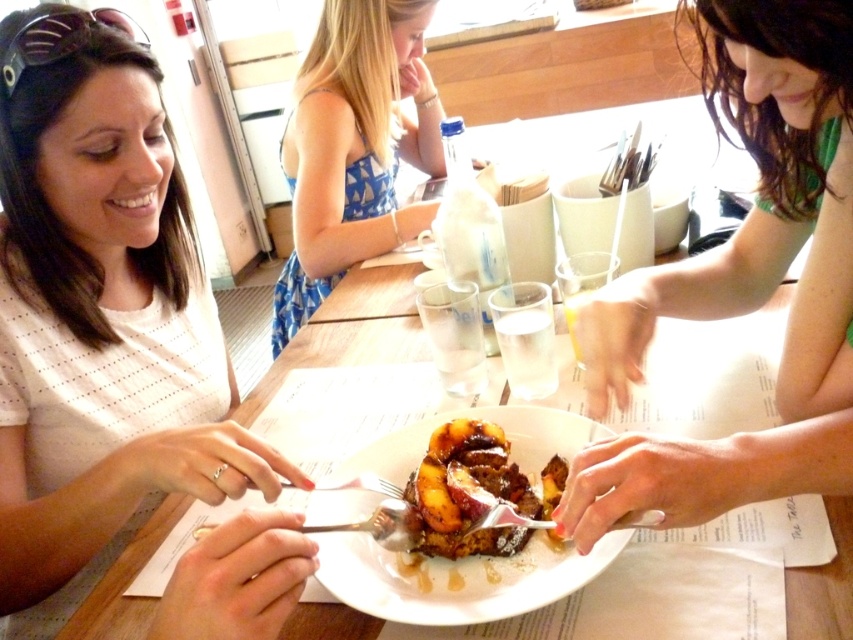
Question: Can you confirm if blue printed dress at center is smaller than crispy golden-brown bread pudding with caramelized peaches at center?

Choices:
 (A) no
 (B) yes

Answer: (A)

Question: Does white dotted shirt at left appear on the left side of matte green shirt at right?

Choices:
 (A) no
 (B) yes

Answer: (B)

Question: Is matte green shirt at right below crispy golden-brown bread pudding with caramelized peaches at center?

Choices:
 (A) no
 (B) yes

Answer: (A)

Question: Which is farther from the blue printed dress at center?

Choices:
 (A) golden brown syrup-soaked bread at center
 (B) crispy golden-brown bread pudding with caramelized peaches at center

Answer: (B)

Question: Which of these objects is positioned closest to the crispy golden-brown bread pudding with caramelized peaches at center?

Choices:
 (A) white dotted shirt at left
 (B) golden brown syrup-soaked bread at center
 (C) matte green shirt at right

Answer: (B)

Question: Which is nearer to the crispy golden-brown bread pudding with caramelized peaches at center?

Choices:
 (A) golden brown syrup-soaked bread at center
 (B) matte green shirt at right

Answer: (A)